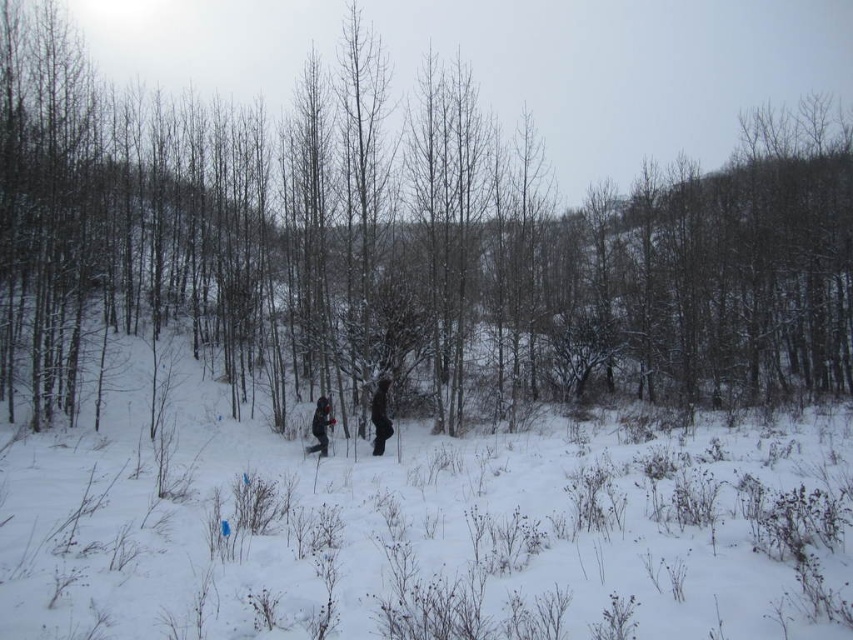
You are planning to take a photo of the snowy bark tree at center and the dark gray fabric couple at center. Which object is wider in the image?

The snowy bark tree at center is wider than the dark gray fabric couple at center.

From the picture: You are planning to take a photo of the dark gray fabric couple at center and the dark gray fabric person at center in the snowy forest. Which one should you focus on if you want to capture the larger subject in the frame?

The dark gray fabric couple at center is bigger than the dark gray fabric person at center, so you should focus on the dark gray fabric couple at center to capture the larger subject in the frame.